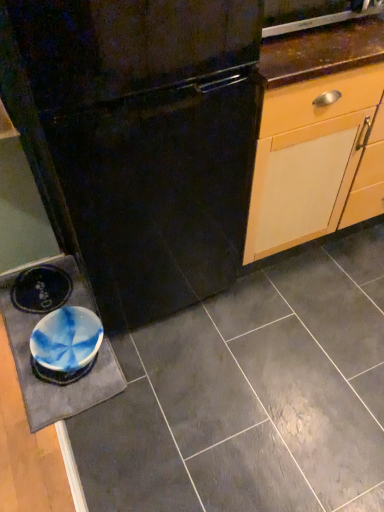
Question: Based on their sizes in the image, would you say black matte refrigerator at center is bigger or smaller than metallic stainless steel dishwasher at upper right?

Choices:
 (A) big
 (B) small

Answer: (A)

Question: Which is correct: black matte refrigerator at center is inside metallic stainless steel dishwasher at upper right, or outside of it?

Choices:
 (A) inside
 (B) outside

Answer: (B)

Question: Which of these objects is positioned farthest from the matte ceramic tile at center?

Choices:
 (A) metallic stainless steel dishwasher at upper right
 (B) black matte refrigerator at center
 (C) blue marbled slate at lower left

Answer: (A)

Question: Estimate the real-world distances between objects in this image. Which object is closer to the metallic stainless steel dishwasher at upper right?

Choices:
 (A) matte ceramic tile at center
 (B) black matte refrigerator at center
 (C) blue marbled slate at lower left

Answer: (B)